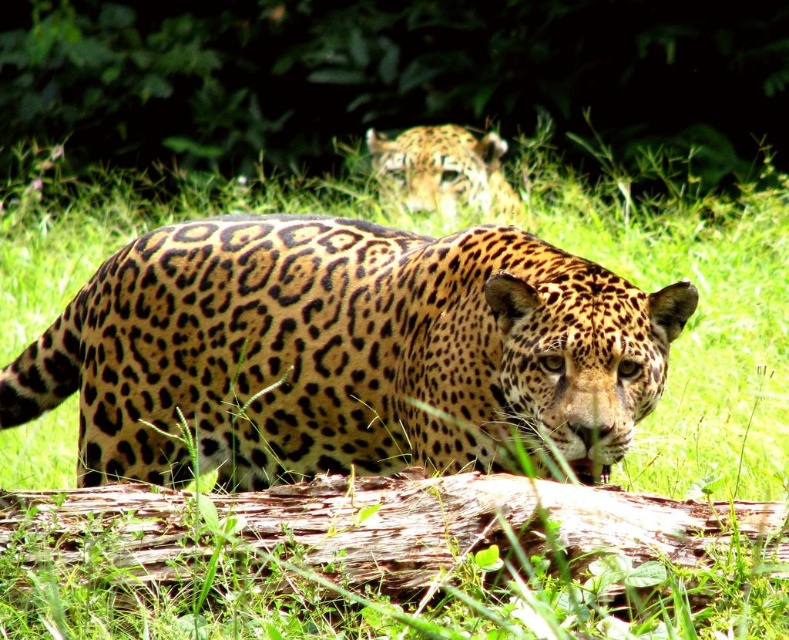
Question: Can you confirm if spotted fur jaguar at center is positioned to the right of spotted fur jaguar at upper center?

Choices:
 (A) yes
 (B) no

Answer: (B)

Question: Which point appears closest to the camera in this image?

Choices:
 (A) (387, 154)
 (B) (83, 481)

Answer: (B)

Question: Is spotted fur jaguar at center below spotted fur jaguar at upper center?

Choices:
 (A) yes
 (B) no

Answer: (A)

Question: Which object is closer to the camera taking this photo?

Choices:
 (A) spotted fur jaguar at upper center
 (B) spotted fur jaguar at center

Answer: (B)

Question: From the image, what is the correct spatial relationship of spotted fur jaguar at center in relation to spotted fur jaguar at upper center?

Choices:
 (A) right
 (B) left

Answer: (B)